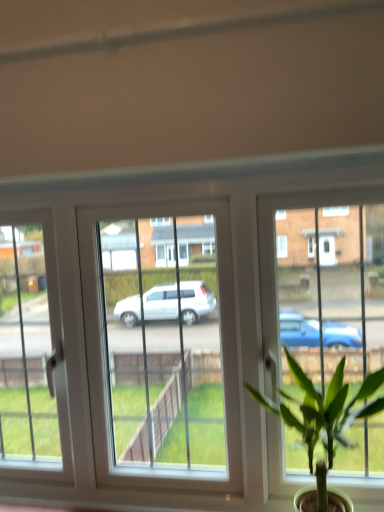
Measure the distance between point (347, 445) and camera.

Point (347, 445) is 38.11 inches away from camera.

The image size is (384, 512). Describe the element at coordinates (323, 408) in the screenshot. I see `green leafy plant at center` at that location.

You are a GUI agent. You are given a task and a screenshot of the screen. Output one action in this format:
    pyautogui.click(x=<x>, y=<y>)
    Task: Click on the green leafy plant at center
    
    Given the screenshot: What is the action you would take?
    pyautogui.click(x=323, y=408)

The image size is (384, 512). Identify the location of green leafy plant at center. pos(323,408).